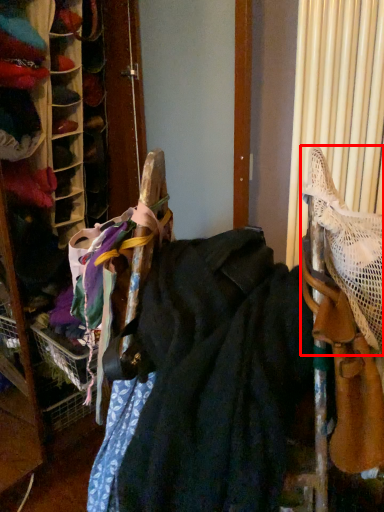
Question: From the image's perspective, where is wide (annotated by the red box) located in relation to wide in the image?

Choices:
 (A) below
 (B) above

Answer: (B)